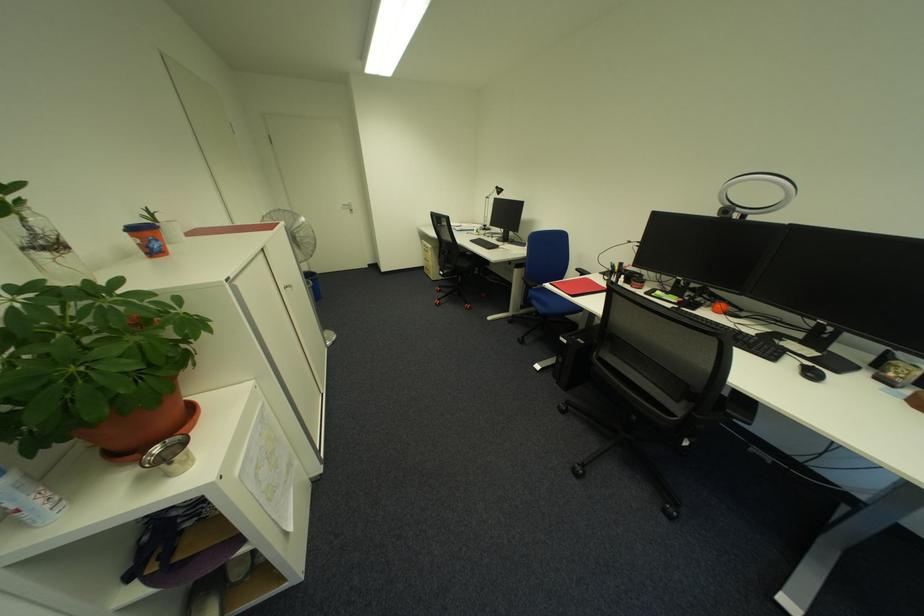
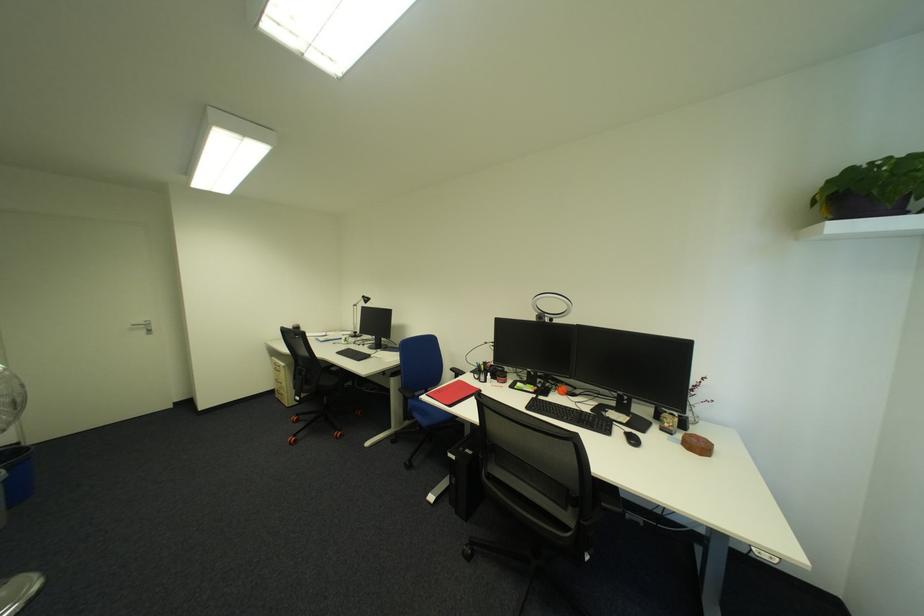
Find the pixel in the second image that matches point (588, 270) in the first image.

(462, 370)